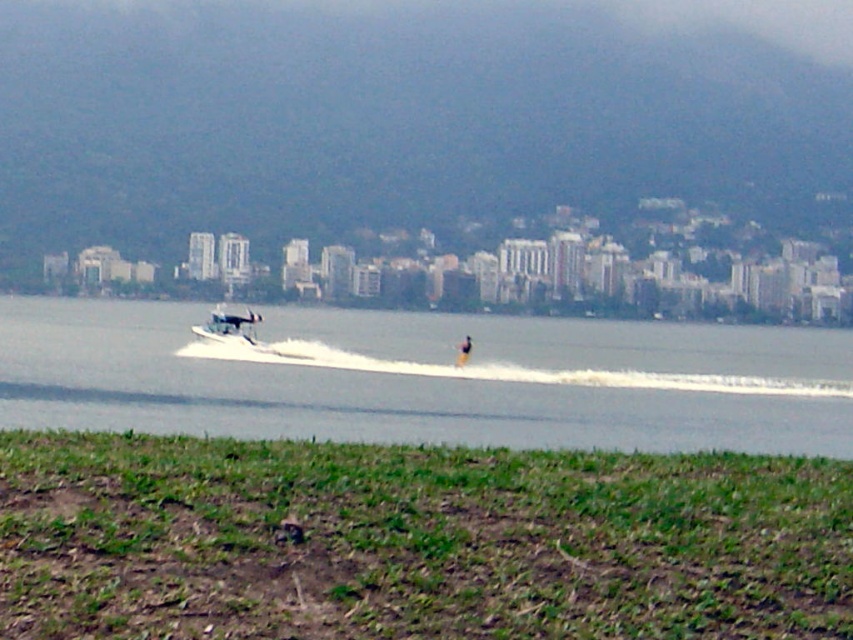
Question: Which point appears farthest from the camera in this image?

Choices:
 (A) (212, 308)
 (B) (369, 419)

Answer: (A)

Question: Which of these objects is positioned closest to the clear water at center?

Choices:
 (A) white matte boat at center
 (B) yellow fabric person at center

Answer: (A)

Question: Is clear water at center below white matte boat at center?

Choices:
 (A) yes
 (B) no

Answer: (A)

Question: Does clear water at center appear under yellow fabric person at center?

Choices:
 (A) yes
 (B) no

Answer: (B)

Question: Which object appears farthest from the camera in this image?

Choices:
 (A) clear water at center
 (B) yellow fabric person at center
 (C) white matte boat at center

Answer: (C)

Question: Is clear water at center smaller than yellow fabric person at center?

Choices:
 (A) yes
 (B) no

Answer: (B)